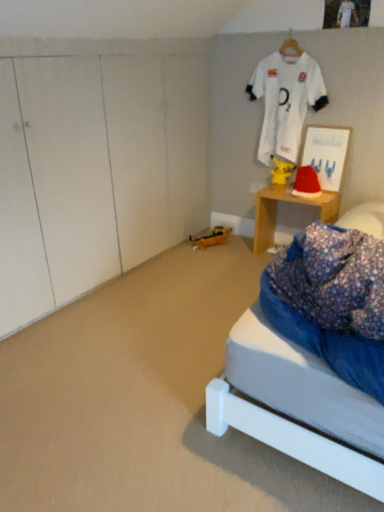
Image resolution: width=384 pixels, height=512 pixels. Describe the element at coordinates (286, 99) in the screenshot. I see `white jersey at upper center` at that location.

Based on the photo, measure the distance between yellow matte pikachu at center and camera.

The distance of yellow matte pikachu at center from camera is 10.27 feet.

The width and height of the screenshot is (384, 512). Identify the location of wooden desk at right. (288, 202).

Locate an element on the screen. white jersey at upper center is located at coordinates (286, 99).

From the image's perspective, between red velvet santa hat at right and wooden desk at right, which one is located above?

From the image's view, red velvet santa hat at right is above.

Looking at this image, could you tell me if red velvet santa hat at right is turned towards wooden desk at right?

No, red velvet santa hat at right is not aimed at wooden desk at right.

Is red velvet santa hat at right in front of or behind wooden desk at right in the image?

red velvet santa hat at right is positioned farther from the viewer than wooden desk at right.

From a real-world perspective, is yellow matte pikachu at center physically located above or below red velvet santa hat at right?

yellow matte pikachu at center is above red velvet santa hat at right.

Measure the distance between yellow matte pikachu at center and red velvet santa hat at right.

yellow matte pikachu at center is 7.40 inches away from red velvet santa hat at right.

Is yellow matte pikachu at center not within red velvet santa hat at right?

yellow matte pikachu at center lies outside red velvet santa hat at right's area.

Is yellow matte pikachu at center to the left of red velvet santa hat at right from the viewer's perspective?

Correct, you'll find yellow matte pikachu at center to the left of red velvet santa hat at right.

From the image's perspective, would you say matte white picture frame at upper right is shown under wooden desk at right?

No, from the image's perspective, matte white picture frame at upper right is not below wooden desk at right.

Does matte white picture frame at upper right appear on the right side of wooden desk at right?

Correct, you'll find matte white picture frame at upper right to the right of wooden desk at right.

Is matte white picture frame at upper right surrounding wooden desk at right?

That's incorrect, wooden desk at right is not inside matte white picture frame at upper right.

Is matte white picture frame at upper right positioned with its back to wooden desk at right?

No, matte white picture frame at upper right is not facing the opposite direction of wooden desk at right.

Is red velvet santa hat at right turned away from white jersey at upper center?

Yes, red velvet santa hat at right's orientation is away from white jersey at upper center.

Which is farther, (309, 194) or (275, 63)?

The point (275, 63) is farther.

Which is behind, red velvet santa hat at right or white jersey at upper center?

red velvet santa hat at right.

Looking at their sizes, would you say matte white picture frame at upper right is wider or thinner than yellow matte pikachu at center?

matte white picture frame at upper right is wider than yellow matte pikachu at center.

Which is closer to the camera, (335, 169) or (292, 163)?

Positioned in front is point (335, 169).

From a real-world perspective, who is located higher, matte white picture frame at upper right or yellow matte pikachu at center?

In real-world perspective, matte white picture frame at upper right is above.

Looking at this image, does matte white picture frame at upper right have a lesser width compared to white jersey at upper center?

No, matte white picture frame at upper right is not thinner than white jersey at upper center.

In the scene shown: From the image's perspective, would you say matte white picture frame at upper right is positioned over white jersey at upper center?

No, from the image's perspective, matte white picture frame at upper right is not over white jersey at upper center.

Consider the image. How much distance is there between matte white picture frame at upper right and white jersey at upper center?

matte white picture frame at upper right is 10.63 inches from white jersey at upper center.

Is matte white picture frame at upper right completely or partially outside of white jersey at upper center?

Actually, matte white picture frame at upper right is at least partially inside white jersey at upper center.

Which of these two, wooden desk at right or red velvet santa hat at right, is smaller?

red velvet santa hat at right is smaller.

Is wooden desk at right wider or thinner than red velvet santa hat at right?

In the image, wooden desk at right appears to be wider than red velvet santa hat at right.

I want to click on desk located below the red velvet santa hat at right (from the image's perspective), so tap(288, 202).

From the image's perspective, is wooden desk at right located beneath red velvet santa hat at right?

Yes.

Locate an element on the screen. desk lying below the red velvet santa hat at right (from the image's perspective) is located at coordinates (288, 202).

This screenshot has height=512, width=384. I want to click on toy lying behind the red velvet santa hat at right, so click(281, 170).

Estimate the real-world distances between objects in this image. Which object is closer to yellow matte pikachu at center, red velvet santa hat at right or matte white picture frame at upper right?

red velvet santa hat at right lies closer to yellow matte pikachu at center than the other object.

From the image, which object appears to be farther from matte white picture frame at upper right, white jersey at upper center or wooden desk at right?

Among the two, wooden desk at right is located further to matte white picture frame at upper right.

Based on their spatial positions, is yellow matte pikachu at center or white jersey at upper center closer to matte white picture frame at upper right?

yellow matte pikachu at center is positioned closer to the anchor matte white picture frame at upper right.

Based on their spatial positions, is matte white picture frame at upper right or red velvet santa hat at right further from wooden desk at right?

matte white picture frame at upper right is further to wooden desk at right.

From the image, which object appears to be farther from white jersey at upper center, yellow matte pikachu at center or wooden desk at right?

The object further to white jersey at upper center is wooden desk at right.

Looking at the image, which one is located further to white jersey at upper center, matte white picture frame at upper right or wooden desk at right?

wooden desk at right is positioned further to the anchor white jersey at upper center.

When comparing their distances from yellow matte pikachu at center, does matte white picture frame at upper right or red velvet santa hat at right seem closer?

red velvet santa hat at right is positioned closer to the anchor yellow matte pikachu at center.

Estimate the real-world distances between objects in this image. Which object is closer to yellow matte pikachu at center, red velvet santa hat at right or wooden desk at right?

Based on the image, red velvet santa hat at right appears to be nearer to yellow matte pikachu at center.

This screenshot has width=384, height=512. What are the coordinates of `toy between matte white picture frame at upper right and wooden desk at right vertically` in the screenshot? It's located at (281, 170).

You are a GUI agent. You are given a task and a screenshot of the screen. Output one action in this format:
    pyautogui.click(x=<x>, y=<y>)
    Task: Click on the picture frame between white jersey at upper center and red velvet santa hat at right vertically
    Image resolution: width=384 pixels, height=512 pixels.
    Given the screenshot: What is the action you would take?
    pyautogui.click(x=326, y=154)

Where is `picture frame between white jersey at upper center and wooden desk at right from top to bottom`? This screenshot has height=512, width=384. picture frame between white jersey at upper center and wooden desk at right from top to bottom is located at coordinates (326, 154).

What are the coordinates of `hat between yellow matte pikachu at center and wooden desk at right in the vertical direction` in the screenshot? It's located at (306, 183).